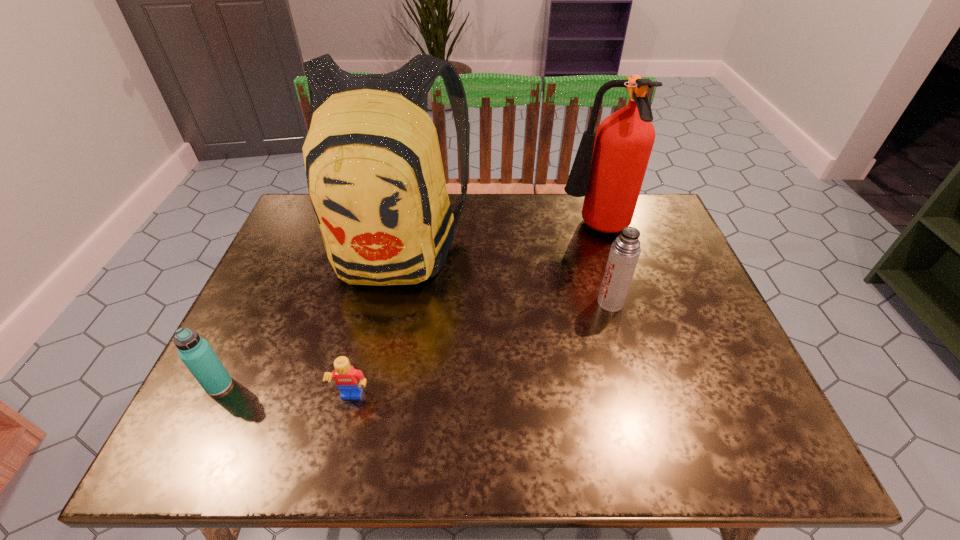
Where is `free space located at the nozzle of the fire extinguisher`? Image resolution: width=960 pixels, height=540 pixels. free space located at the nozzle of the fire extinguisher is located at coordinates (489, 230).

I want to click on vacant point located 0.070m on the front of the third shortest object, so click(620, 335).

At what (x,y) coordinates should I click in order to perform the action: click on vacant space located on the back of the left thermos bottle. Please return your answer as a coordinate pair (x, y). Looking at the image, I should click on (256, 309).

Image resolution: width=960 pixels, height=540 pixels. Identify the location of vacant space positioned on the face of the Lego. (342, 443).

The height and width of the screenshot is (540, 960). In order to click on backpack present at the far edge in this screenshot , I will do `click(375, 177)`.

The width and height of the screenshot is (960, 540). Find the location of `fire extinguisher that is at the far edge`. fire extinguisher that is at the far edge is located at coordinates (609, 173).

You are a GUI agent. You are given a task and a screenshot of the screen. Output one action in this format:
    pyautogui.click(x=<x>, y=<y>)
    Task: Click on the backpack present at the left edge
    This screenshot has height=540, width=960.
    Given the screenshot: What is the action you would take?
    pyautogui.click(x=375, y=177)

The height and width of the screenshot is (540, 960). I want to click on thermos bottle at the left edge, so pyautogui.click(x=195, y=352).

Where is `object at the right edge`? object at the right edge is located at coordinates (609, 173).

The height and width of the screenshot is (540, 960). Find the location of `object that is at the far left corner`. object that is at the far left corner is located at coordinates (375, 177).